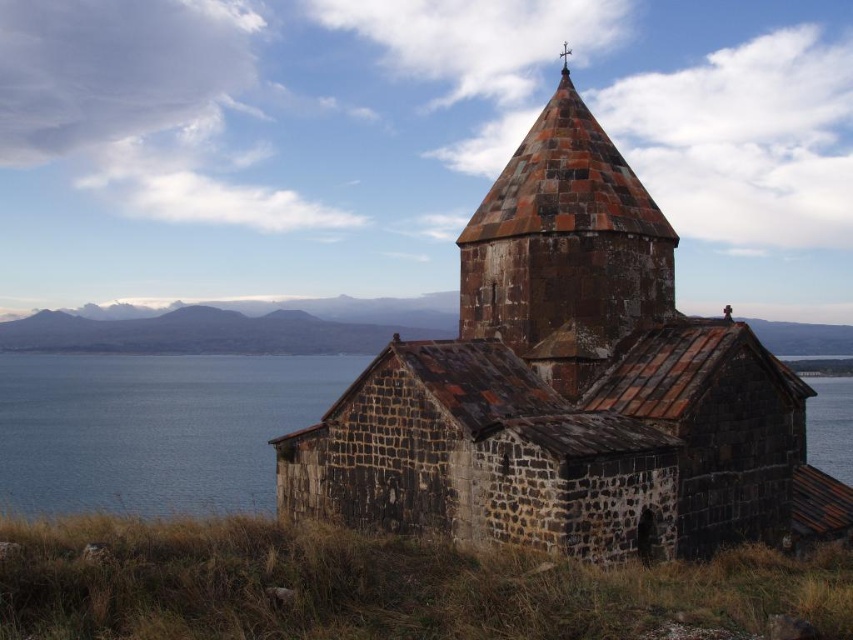
Is rustic stone church at center wider than blue water at lower left?

Incorrect, rustic stone church at center's width does not surpass blue water at lower left's.

Does point (315, 515) come closer to viewer compared to point (263, 362)?

Yes.

Find the location of a particular element. rustic stone church at center is located at coordinates (570, 388).

Is blue water at lower left closer to camera compared to blue water at left?

Yes, blue water at lower left is closer to the viewer.

Describe the element at coordinates (154, 428) in the screenshot. This screenshot has width=853, height=640. I see `blue water at lower left` at that location.

At what (x,y) coordinates should I click in order to perform the action: click on blue water at lower left. Please return your answer as a coordinate pair (x, y). Looking at the image, I should click on (154, 428).

Can you confirm if rustic stone church at center is positioned below rustic stone tower at center?

Indeed, rustic stone church at center is positioned under rustic stone tower at center.

Does point (618, 280) lie behind point (502, 211)?

No, it is in front of (502, 211).

Locate an element on the screen. This screenshot has height=640, width=853. rustic stone church at center is located at coordinates (570, 388).